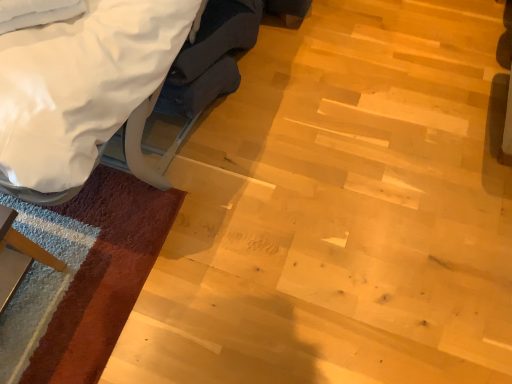
The image size is (512, 384). I want to click on vacant area that lies in front of white fabric swivel chair at upper left, so click(224, 175).